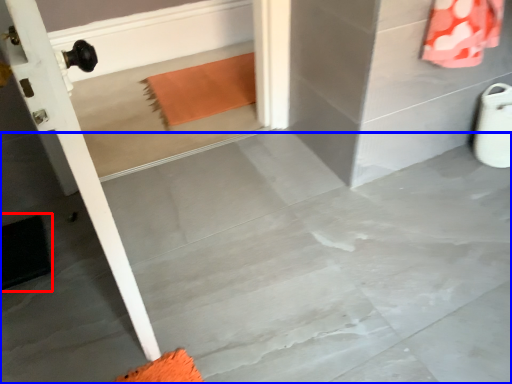
Question: Which of the following is the closest to the observer, doormat (highlighted by a red box) or concrete (highlighted by a blue box)?

Choices:
 (A) doormat
 (B) concrete

Answer: (B)